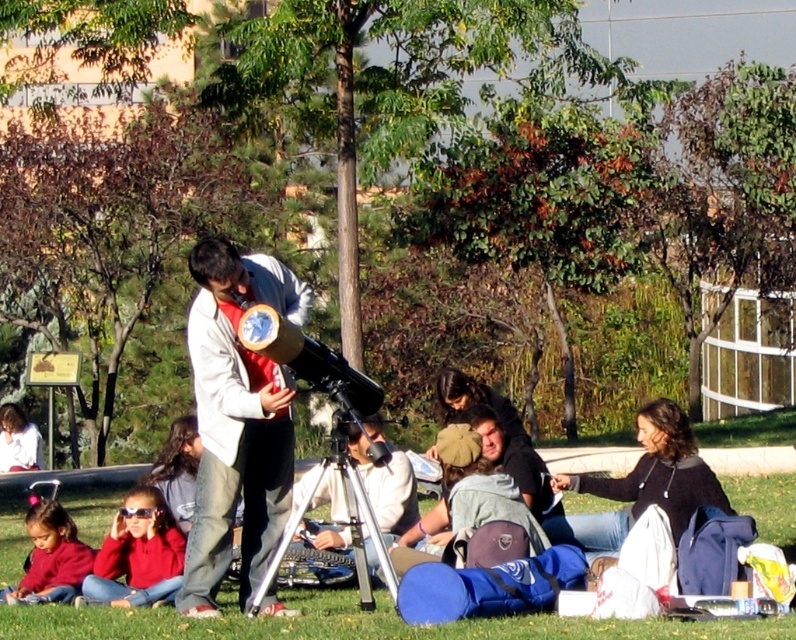
Is matte white telescope at center below matte red sweater at lower left?

Actually, matte white telescope at center is above matte red sweater at lower left.

From the picture: Between matte white telescope at center and matte red sweater at lower left, which one appears on the left side from the viewer's perspective?

matte red sweater at lower left is more to the left.

Find the location of a particular element. matte white telescope at center is located at coordinates [385, 484].

Which of these two, matte white jacket at center or matte red jacket at lower left, stands taller?

matte white jacket at center

From the picture: Can you confirm if matte white jacket at center is thinner than matte red jacket at lower left?

No, matte white jacket at center is not thinner than matte red jacket at lower left.

Image resolution: width=796 pixels, height=640 pixels. In order to click on matte white jacket at center in this screenshot , I will do `click(236, 420)`.

Locate an element on the screen. This screenshot has height=640, width=796. matte white jacket at center is located at coordinates (236, 420).

Is matte red jacket at lower left to the left of matte white telescope at center from the viewer's perspective?

Correct, you'll find matte red jacket at lower left to the left of matte white telescope at center.

Between matte red jacket at lower left and matte white telescope at center, which one has less height?

Standing shorter between the two is matte white telescope at center.

This screenshot has height=640, width=796. I want to click on matte red jacket at lower left, so click(x=137, y=554).

Where is `matte red jacket at lower left`? matte red jacket at lower left is located at coordinates (137, 554).